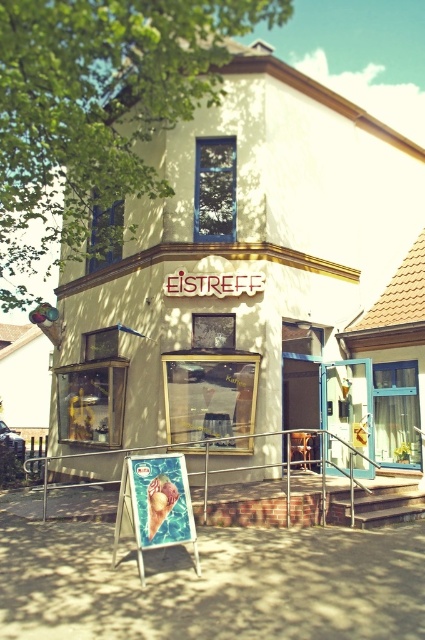
Does point (258, 280) come behind point (206, 515)?

That is True.

Can you confirm if white matte storefront at center is positioned to the right of metallic silver rail at center?

In fact, white matte storefront at center is to the left of metallic silver rail at center.

Describe the element at coordinates (238, 276) in the screenshot. I see `white matte storefront at center` at that location.

At what (x,y) coordinates should I click in order to perform the action: click on white matte storefront at center. Please return your answer as a coordinate pair (x, y). Looking at the image, I should click on (238, 276).

At what (x,y) coordinates should I click in order to perform the action: click on green leafy tree at upper left. Please return your answer as a coordinate pair (x, y). This screenshot has height=640, width=425. Looking at the image, I should click on (96, 108).

Looking at this image, is green leafy tree at upper left smaller than metallic ice cream cone at center?

No, green leafy tree at upper left is not smaller than metallic ice cream cone at center.

Is point (74, 84) less distant than point (184, 541)?

No, it is not.

At what (x,y) coordinates should I click in order to perform the action: click on green leafy tree at upper left. Please return your answer as a coordinate pair (x, y). This screenshot has height=640, width=425. Looking at the image, I should click on (96, 108).

Can you confirm if white matte storefront at center is smaller than metallic ice cream cone at center?

Actually, white matte storefront at center might be larger than metallic ice cream cone at center.

Can you confirm if white matte storefront at center is positioned above metallic ice cream cone at center?

Correct, white matte storefront at center is located above metallic ice cream cone at center.

What are the coordinates of `white matte storefront at center` in the screenshot? It's located at (238, 276).